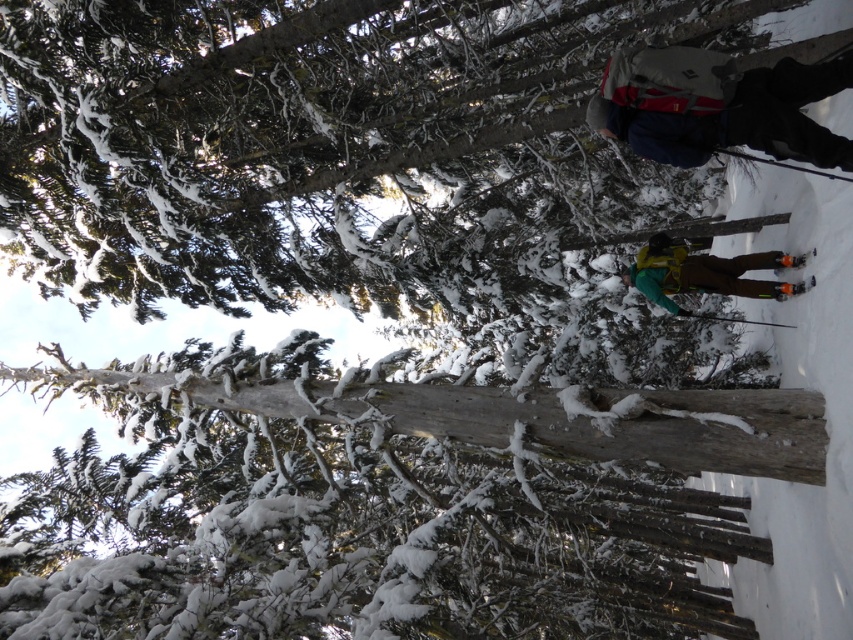
Question: Which object is farther from the camera taking this photo?

Choices:
 (A) gray fabric backpack at upper right
 (B) orange reflective ski at lower right
 (C) yellow-green fabric snowboard at center

Answer: (C)

Question: Observing the image, what is the correct spatial positioning of yellow-green fabric snowboard at center in reference to orange reflective ski at lower right?

Choices:
 (A) right
 (B) left

Answer: (B)

Question: Does gray fabric backpack at upper right appear under orange reflective ski at lower right?

Choices:
 (A) no
 (B) yes

Answer: (A)

Question: From the image, what is the correct spatial relationship of gray fabric backpack at upper right in relation to orange reflective ski at lower right?

Choices:
 (A) below
 (B) above

Answer: (B)

Question: Which object is positioned closest to the yellow-green fabric snowboard at center?

Choices:
 (A) gray fabric backpack at upper right
 (B) orange reflective ski at lower right

Answer: (B)

Question: Which object is the farthest from the gray fabric backpack at upper right?

Choices:
 (A) yellow-green fabric snowboard at center
 (B) orange reflective ski at lower right

Answer: (A)